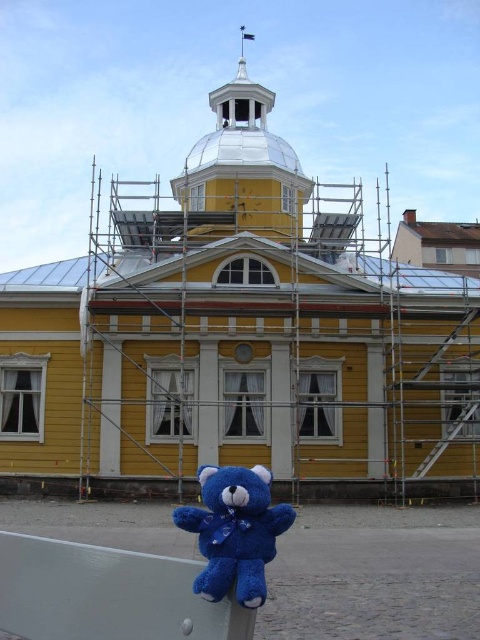
Question: Which point appears closest to the camera in this image?

Choices:
 (A) (238, 480)
 (B) (201, 442)

Answer: (A)

Question: Is yellow wooden church at center above blue plush bear at lower center?

Choices:
 (A) no
 (B) yes

Answer: (B)

Question: Does yellow wooden church at center appear over blue plush bear at lower center?

Choices:
 (A) no
 (B) yes

Answer: (B)

Question: Does yellow wooden church at center appear on the left side of blue plush bear at lower center?

Choices:
 (A) no
 (B) yes

Answer: (A)

Question: Which point is farther from the camera taking this photo?

Choices:
 (A) (264, 573)
 (B) (122, 484)

Answer: (B)

Question: Which object is closer to the camera taking this photo?

Choices:
 (A) yellow wooden church at center
 (B) blue plush bear at lower center

Answer: (B)